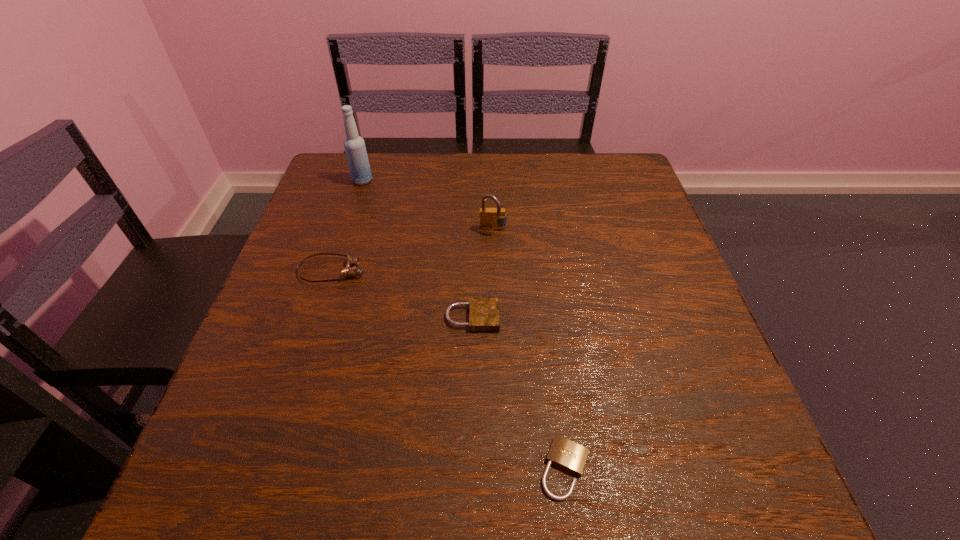
Where is `free space at the far edge of the desktop`? free space at the far edge of the desktop is located at coordinates (540, 154).

Find the location of a particular element. Image resolution: width=960 pixels, height=540 pixels. free space at the left edge is located at coordinates (357, 253).

Where is `free space at the right edge`? free space at the right edge is located at coordinates (627, 343).

This screenshot has height=540, width=960. I want to click on free space at the far left corner of the desktop, so click(x=328, y=188).

Locate an element on the screen. vacant area at the far right corner of the desktop is located at coordinates (636, 197).

This screenshot has width=960, height=540. Find the location of `free space that is in between the fourth nearest object and the second nearest object`. free space that is in between the fourth nearest object and the second nearest object is located at coordinates point(483,274).

Where is `free space between the tallest object and the third nearest object`? The width and height of the screenshot is (960, 540). free space between the tallest object and the third nearest object is located at coordinates tap(348, 226).

Image resolution: width=960 pixels, height=540 pixels. Identify the location of free space between the fourth nearest object and the farthest object. (427, 205).

The image size is (960, 540). Find the location of `free space between the tallest object and the tallest padlock`. free space between the tallest object and the tallest padlock is located at coordinates (427, 205).

Where is `vacant space that is in between the tallest padlock and the rightmost object`? Image resolution: width=960 pixels, height=540 pixels. vacant space that is in between the tallest padlock and the rightmost object is located at coordinates (529, 349).